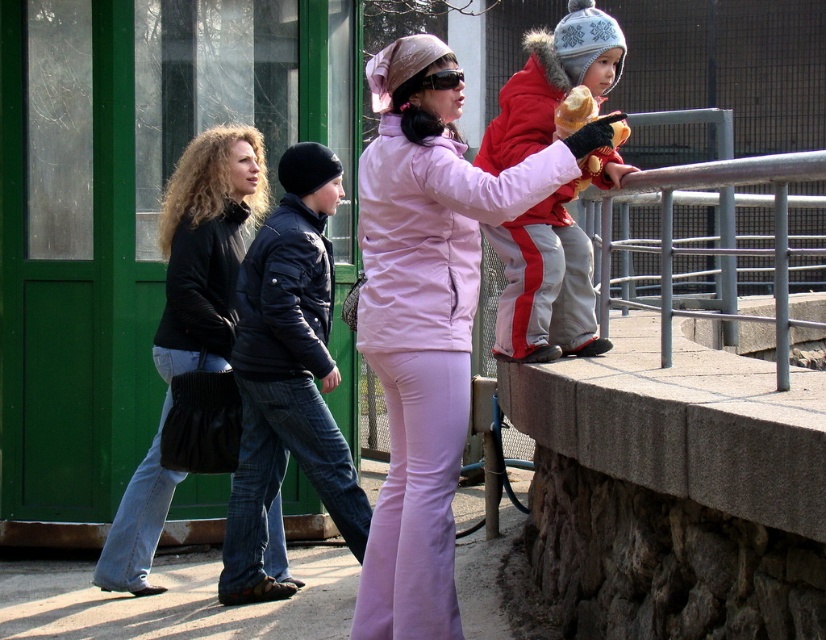
Is black quilted jacket at center wider than red fleece jacket at upper right?

Correct, the width of black quilted jacket at center exceeds that of red fleece jacket at upper right.

Can you confirm if black quilted jacket at center is smaller than red fleece jacket at upper right?

No, black quilted jacket at center is not smaller than red fleece jacket at upper right.

The height and width of the screenshot is (640, 826). Identify the location of black quilted jacket at center. (287, 376).

You are a GUI agent. You are given a task and a screenshot of the screen. Output one action in this format:
    pyautogui.click(x=<x>, y=<y>)
    Task: Click on the pink matte jacket at center
    Image resolution: width=826 pixels, height=640 pixels.
    Given the screenshot: What is the action you would take?
    pyautogui.click(x=426, y=317)

Between pink matte jacket at center and matte black jacket at left, which one has more height?

With more height is matte black jacket at left.

Which is behind, point (362, 346) or point (150, 541)?

Positioned behind is point (150, 541).

Locate an element on the screen. The image size is (826, 640). pink matte jacket at center is located at coordinates (426, 317).

Who is more distant from viewer, (281, 579) or (586, 80)?

Point (281, 579)

Does matte black jacket at left have a smaller size compared to red fleece jacket at upper right?

No.

Describe the element at coordinates (206, 244) in the screenshot. The width and height of the screenshot is (826, 640). I see `matte black jacket at left` at that location.

The image size is (826, 640). What are the coordinates of `matte black jacket at left` in the screenshot? It's located at (206, 244).